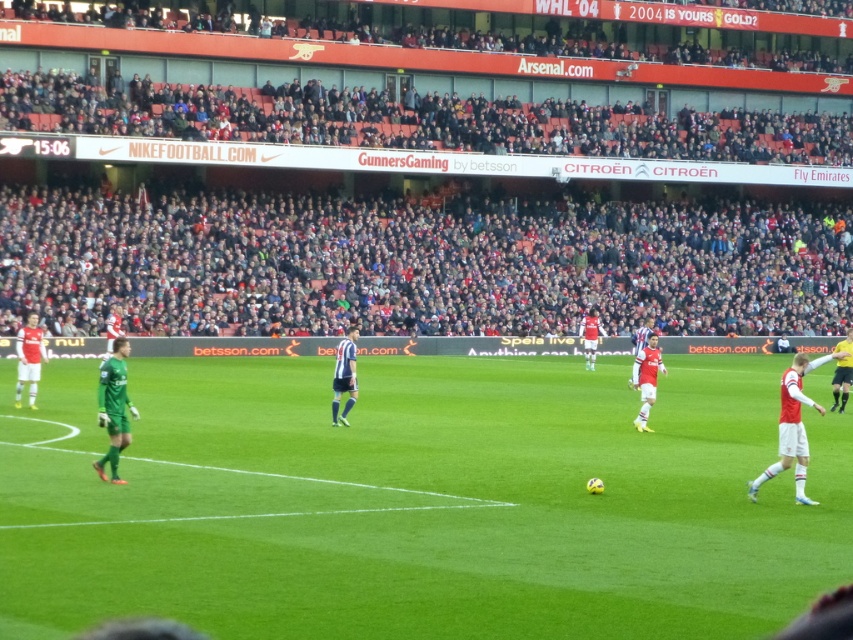
Question: Observing the image, what is the correct spatial positioning of green grass field at center in reference to white matte jersey at center?

Choices:
 (A) left
 (B) right

Answer: (A)

Question: Which of the following is the farthest from the observer?

Choices:
 (A) (27, 330)
 (B) (798, 362)
 (C) (688, 592)
 (D) (102, 458)

Answer: (A)

Question: Is white matte jersey at center closer to camera compared to yellow jersey at right?

Choices:
 (A) yes
 (B) no

Answer: (A)

Question: Can you confirm if green grass field at center is smaller than white jersey at right?

Choices:
 (A) no
 (B) yes

Answer: (A)

Question: Which point is closer to the camera taking this photo?

Choices:
 (A) (491, 376)
 (B) (851, 337)
 (C) (36, 387)

Answer: (B)

Question: Based on their relative distances, which object is farther from the blue striped jersey at center?

Choices:
 (A) yellow jersey at right
 (B) green grass field at center

Answer: (A)